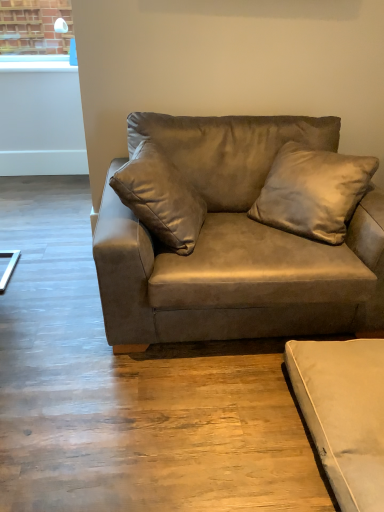
Question: In terms of height, does suede brown couch at center, which is the 2th studio couch in bottom-to-top order, look taller or shorter compared to beige suede studio couch at lower right, which is the 1th studio couch from bottom to top?

Choices:
 (A) tall
 (B) short

Answer: (A)

Question: Is point (230, 282) positioned closer to the camera than point (362, 430)?

Choices:
 (A) farther
 (B) closer

Answer: (A)

Question: Which of these objects is positioned closest to the suede-like beige pillow at upper center?

Choices:
 (A) beige suede studio couch at lower right, which appears as the 2th studio couch when viewed from the top
 (B) suede brown couch at center, placed as the first studio couch when sorted from top to bottom

Answer: (B)

Question: Which of these objects is positioned closest to the suede-like beige pillow at upper center?

Choices:
 (A) suede brown couch at center, placed as the first studio couch when sorted from top to bottom
 (B) beige suede studio couch at lower right, which is the 1th studio couch from bottom to top

Answer: (A)